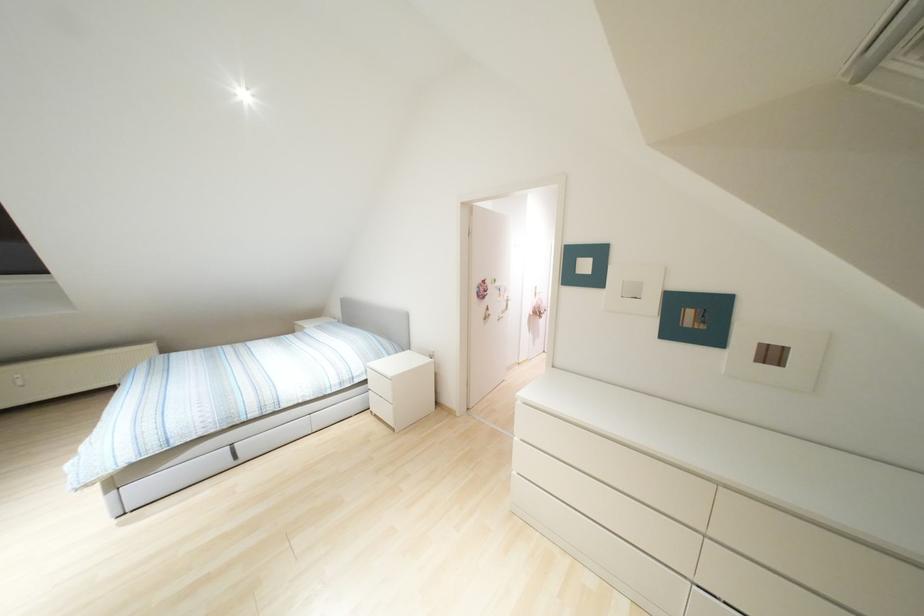
This screenshot has width=924, height=616. Describe the element at coordinates (234, 453) in the screenshot. I see `a grey drawer pull` at that location.